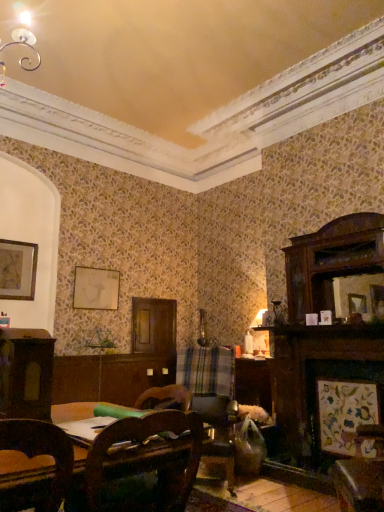
Find the location of a particular element. The width and height of the screenshot is (384, 512). empty space that is ontop of matte white picture frame at upper center, the third picture frame viewed from the right (from a real-world perspective) is located at coordinates (98, 266).